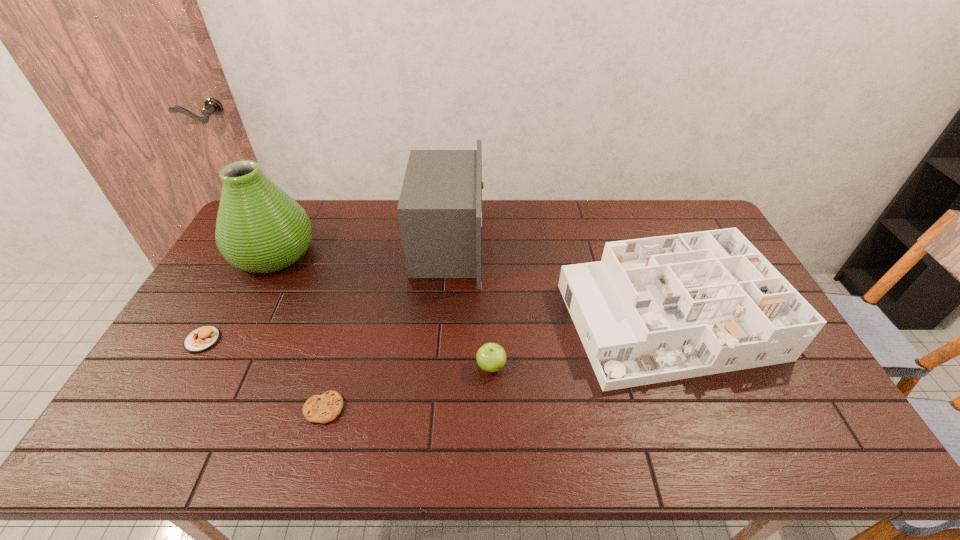
You are a GUI agent. You are given a task and a screenshot of the screen. Output one action in this format:
    pyautogui.click(x=<x>, y=<y>)
    Task: Click on the free space located on the left of the rightmost object
    The width and height of the screenshot is (960, 540).
    Given the screenshot: What is the action you would take?
    pyautogui.click(x=490, y=321)

The image size is (960, 540). Identify the location of vacant space located on the left of the apple. (375, 366).

Identify the location of free space located on the right of the patty. (311, 340).

At what (x,y) coordinates should I click in order to perform the action: click on vacant space located on the right of the third object from left to right. Please return your answer as a coordinate pair (x, y). Looking at the image, I should click on (485, 409).

I want to click on vase present at the far edge, so click(x=260, y=229).

In order to click on microwave oven situated at the far edge in this screenshot , I will do `click(440, 207)`.

Identify the location of object present at the near edge. (324, 408).

Where is `vase at the left edge`? The height and width of the screenshot is (540, 960). vase at the left edge is located at coordinates (260, 229).

Identify the location of patty that is at the left edge. (202, 338).

The height and width of the screenshot is (540, 960). Find the location of `object located at the right edge`. object located at the right edge is located at coordinates (657, 309).